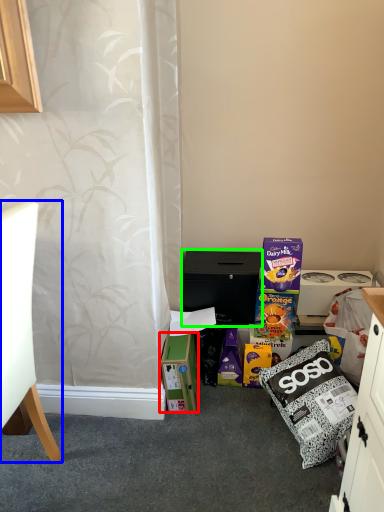
Question: Considering the real-world distances, which object is closest to box (highlighted by a red box)? chair (highlighted by a blue box) or cabinetry (highlighted by a green box).

Choices:
 (A) chair
 (B) cabinetry

Answer: (B)